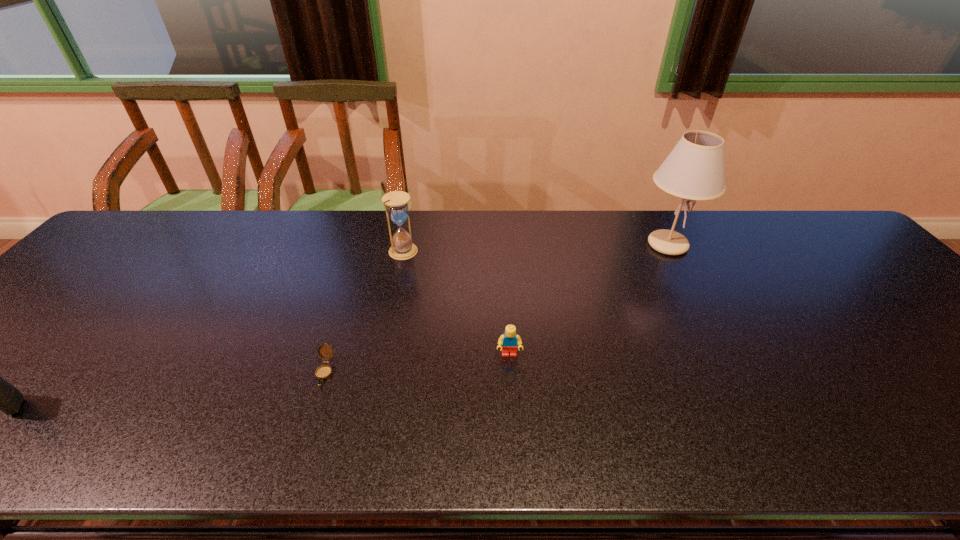
Locate an element on the screen. This screenshot has width=960, height=540. free space located on the face of the second object from left to right is located at coordinates (301, 444).

The width and height of the screenshot is (960, 540). Identify the location of lampshade located in the far edge section of the desktop. (694, 170).

Where is `hourglass that is at the far edge`? The width and height of the screenshot is (960, 540). hourglass that is at the far edge is located at coordinates (402, 247).

The height and width of the screenshot is (540, 960). I want to click on free space at the far edge, so click(417, 232).

The height and width of the screenshot is (540, 960). What are the coordinates of `vacant space at the near edge of the desktop` in the screenshot? It's located at (465, 450).

In the image, there is a desktop. At what (x,y) coordinates should I click in order to perform the action: click on blank space at the left edge. Please return your answer as a coordinate pair (x, y). The height and width of the screenshot is (540, 960). Looking at the image, I should click on (92, 262).

Locate an element on the screen. free space at the right edge of the desktop is located at coordinates (910, 360).

Find the location of `vacant area at the far left corner of the desktop`. vacant area at the far left corner of the desktop is located at coordinates (122, 240).

You are a GUI agent. You are given a task and a screenshot of the screen. Output one action in this format:
    pyautogui.click(x=<x>, y=<y>)
    Task: Click on the empty space between the third object from right to left and the shortest object
    This screenshot has height=540, width=960.
    Given the screenshot: What is the action you would take?
    point(364,311)

Identify the location of vacant point located between the tallest object and the fourth object from right to left. (496, 308).